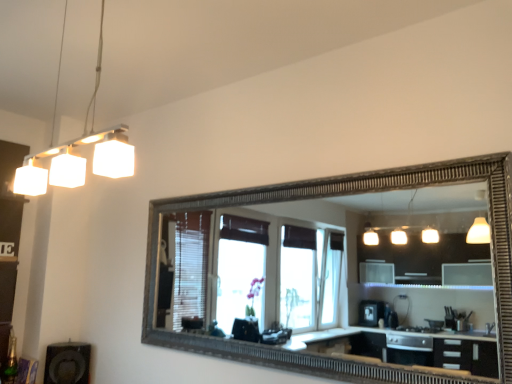
Question: Considering the relative sizes of matte white dresser at left and black matte speaker at lower left in the image provided, is matte white dresser at left bigger than black matte speaker at lower left?

Choices:
 (A) yes
 (B) no

Answer: (A)

Question: Would you say black matte speaker at lower left is part of matte white dresser at left's contents?

Choices:
 (A) yes
 (B) no

Answer: (B)

Question: Considering the relative sizes of matte white dresser at left and black matte speaker at lower left in the image provided, is matte white dresser at left thinner than black matte speaker at lower left?

Choices:
 (A) yes
 (B) no

Answer: (A)

Question: From a real-world perspective, is matte white dresser at left physically below black matte speaker at lower left?

Choices:
 (A) yes
 (B) no

Answer: (B)

Question: Is matte white dresser at left placed right next to black matte speaker at lower left?

Choices:
 (A) yes
 (B) no

Answer: (B)

Question: From the image's perspective, does matte white dresser at left appear higher than black matte speaker at lower left?

Choices:
 (A) yes
 (B) no

Answer: (A)

Question: Is black matte speaker at lower left completely or partially inside white matte light fixture at upper left?

Choices:
 (A) no
 (B) yes

Answer: (A)

Question: Is white matte light fixture at upper left behind black matte speaker at lower left?

Choices:
 (A) yes
 (B) no

Answer: (B)

Question: Is white matte light fixture at upper left closer to the viewer compared to black matte speaker at lower left?

Choices:
 (A) yes
 (B) no

Answer: (A)

Question: Is black matte speaker at lower left at the back of white matte light fixture at upper left?

Choices:
 (A) no
 (B) yes

Answer: (A)

Question: Is white matte light fixture at upper left shorter than black matte speaker at lower left?

Choices:
 (A) no
 (B) yes

Answer: (A)

Question: Does white matte light fixture at upper left appear on the left side of black matte speaker at lower left?

Choices:
 (A) yes
 (B) no

Answer: (B)

Question: Is matte white dresser at left bigger than white matte light fixture at upper left?

Choices:
 (A) yes
 (B) no

Answer: (A)